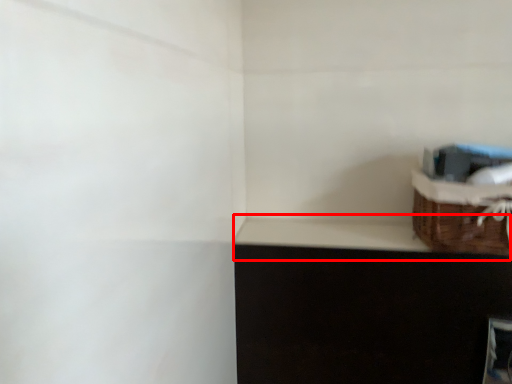
Question: In this image, where is window sill (annotated by the red box) located relative to basket?

Choices:
 (A) left
 (B) right

Answer: (A)